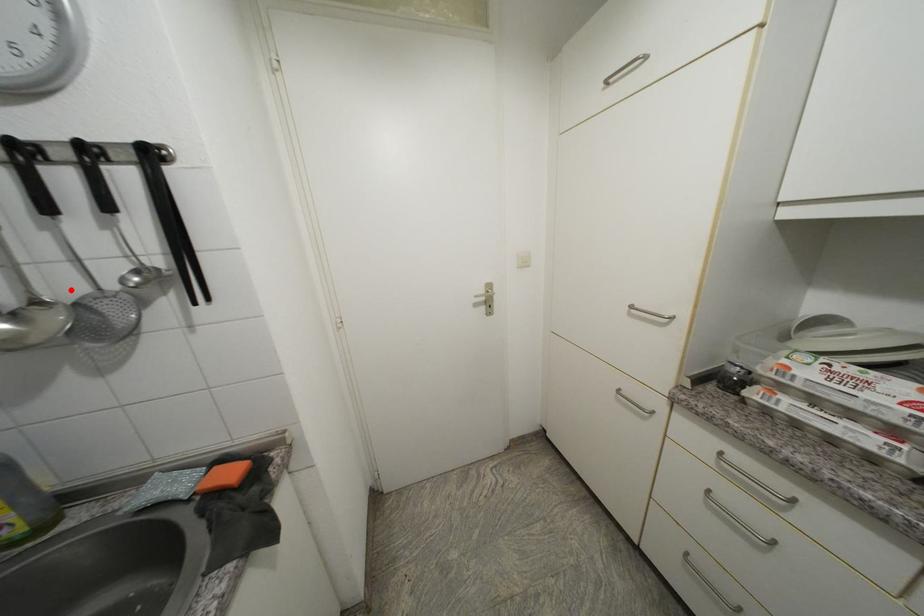
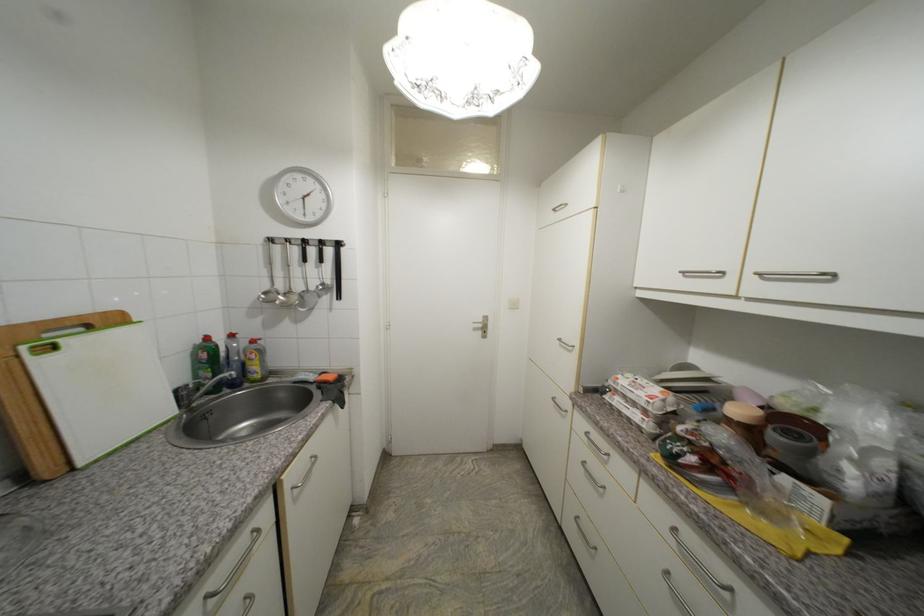
In the second image, find the point that corresponds to the highlighted location in the first image.

(305, 289)